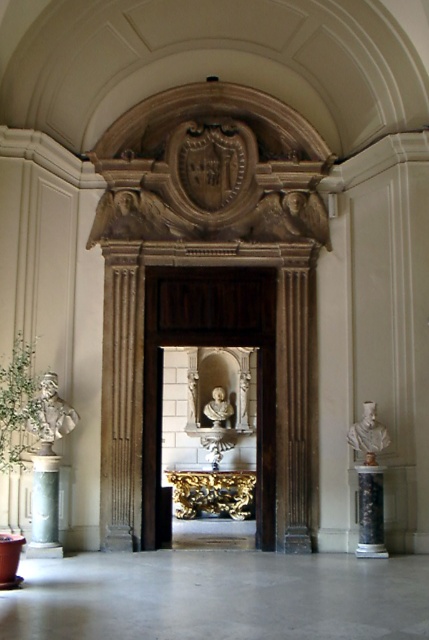
Is blue marble column at right to the left of white marble bust at left from the viewer's perspective?

In fact, blue marble column at right is to the right of white marble bust at left.

Consider the image. Does blue marble column at right have a greater width compared to white marble bust at left?

No.

The width and height of the screenshot is (429, 640). What do you see at coordinates (369, 513) in the screenshot? I see `blue marble column at right` at bounding box center [369, 513].

The image size is (429, 640). Identify the location of blue marble column at right. (369, 513).

The width and height of the screenshot is (429, 640). I want to click on blue marble column at right, so click(x=369, y=513).

Identify the location of blue marble column at right. (369, 513).

How distant is blue marble column at right from white marble bust at center?

blue marble column at right is 5.61 meters from white marble bust at center.

Which is behind, point (380, 488) or point (207, 417)?

Point (207, 417)

Find the location of a particular element. The width and height of the screenshot is (429, 640). blue marble column at right is located at coordinates (369, 513).